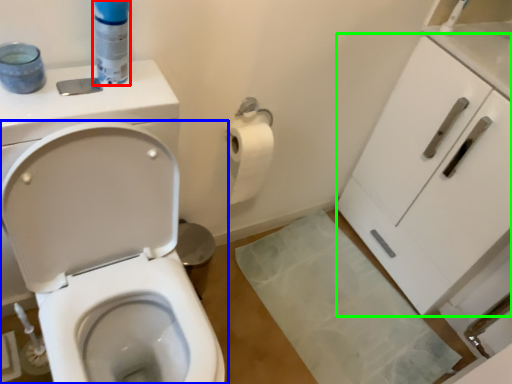
Question: Which object is positioned closest to cleaning product (highlighted by a red box)? Select from toilet (highlighted by a blue box) and cabinetry (highlighted by a green box).

Choices:
 (A) toilet
 (B) cabinetry

Answer: (A)